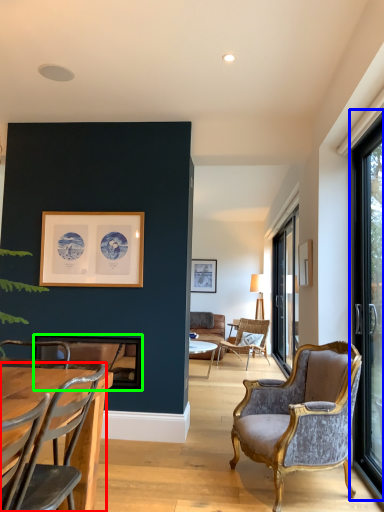
Question: Which object is positioned farthest from chair (highlighted by a red box)? Select from window (highlighted by a blue box) and picture frame (highlighted by a green box).

Choices:
 (A) window
 (B) picture frame

Answer: (A)